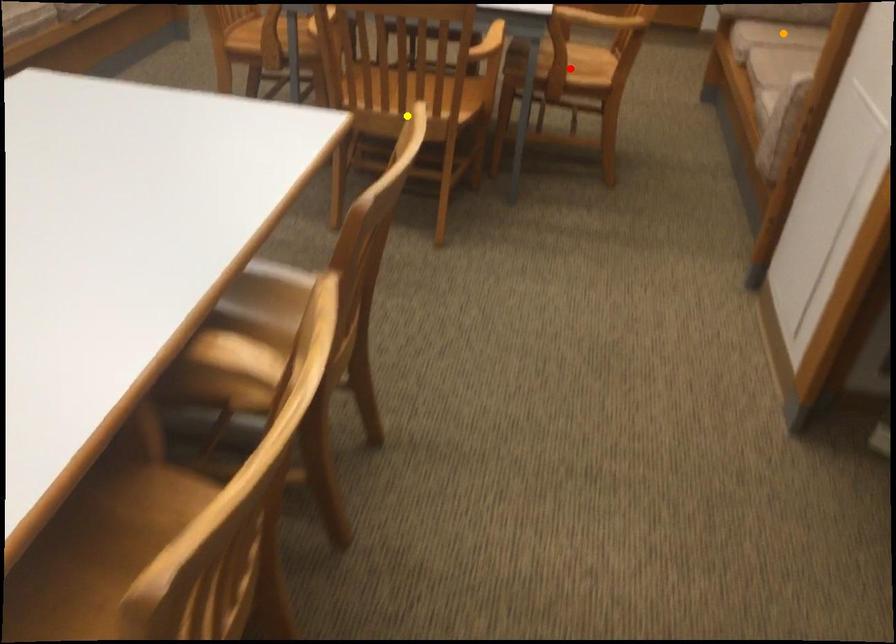
Order these from nearest to farthest:
A) orange point
B) red point
C) yellow point

orange point → yellow point → red point